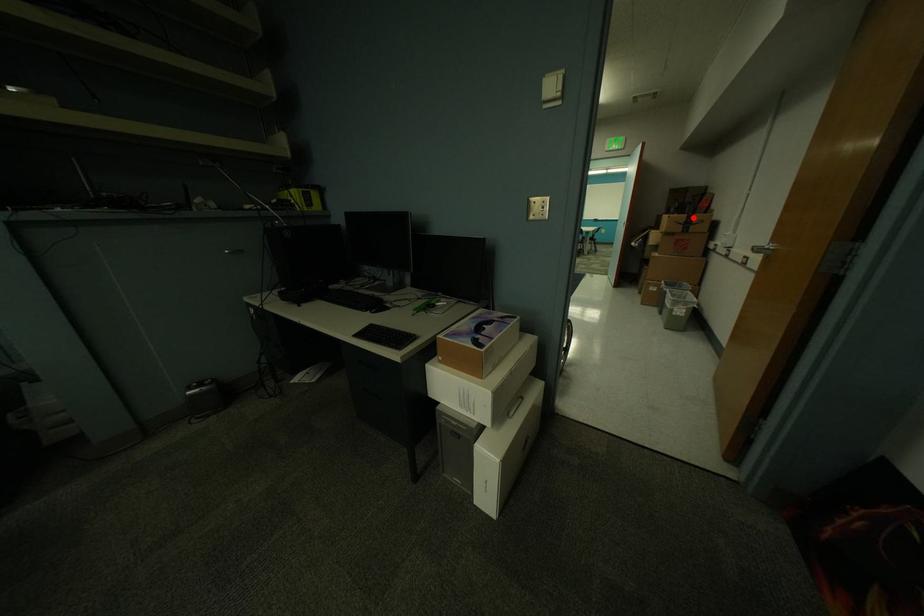
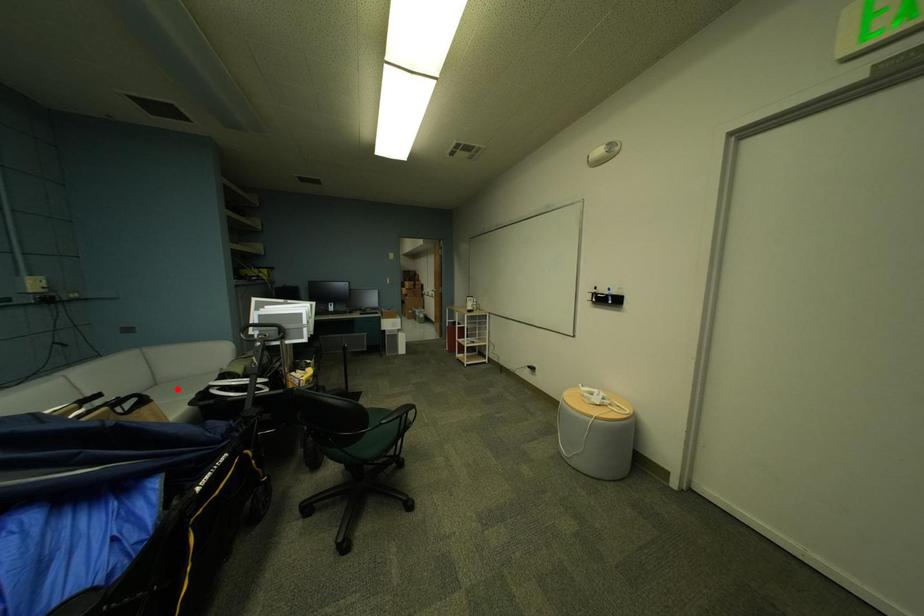
I am providing you with two images of the same scene from different viewpoints. A red point is marked on the first image and another point is marked on the second image. Is the red point in image1 aligned with the point shown in image2?

No